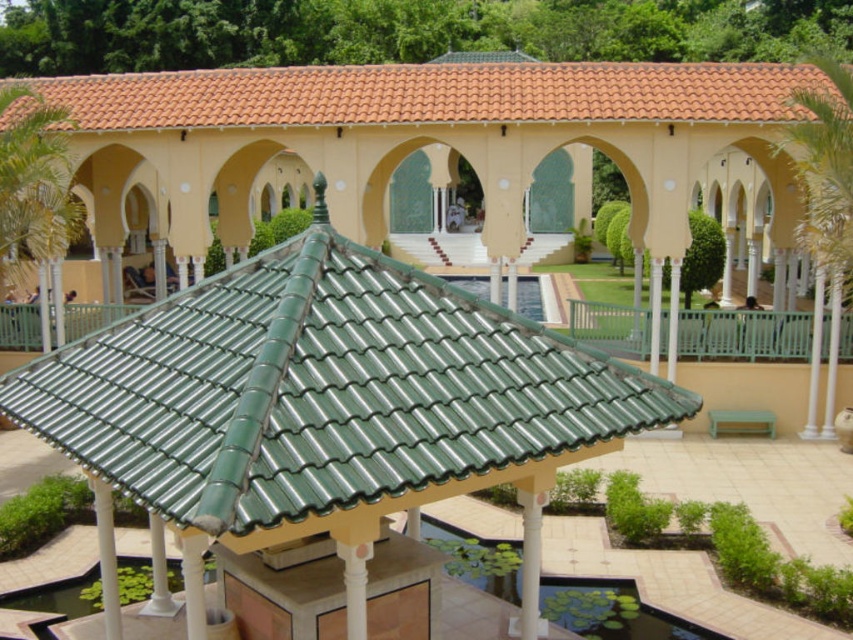
Who is lower down, green tile gazebo at center or orange clay tiles at upper center?

Positioned lower is green tile gazebo at center.

Can you confirm if green tile gazebo at center is wider than orange clay tiles at upper center?

No, green tile gazebo at center is not wider than orange clay tiles at upper center.

In the scene shown: Who is more forward, (161, 422) or (740, 67)?

Point (161, 422) is more forward.

Locate an element on the screen. green tile gazebo at center is located at coordinates (323, 408).